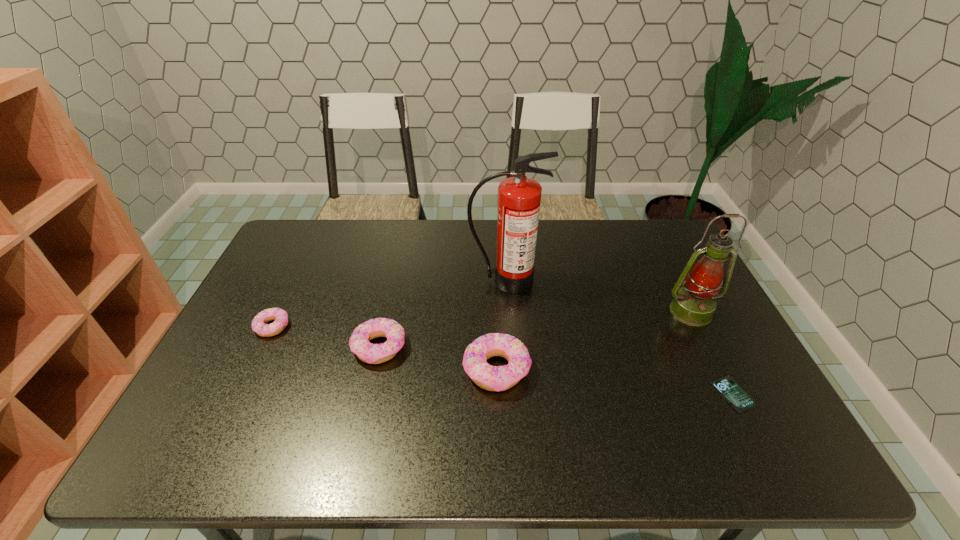
Please point a free position for a doughnut on the right. Please provide its 2D coordinates. Your answer should be formatted as a tuple, i.e. [(x, y)], where the tuple contains the x and y coordinates of a point satisfying the conditions above.

[(626, 394)]